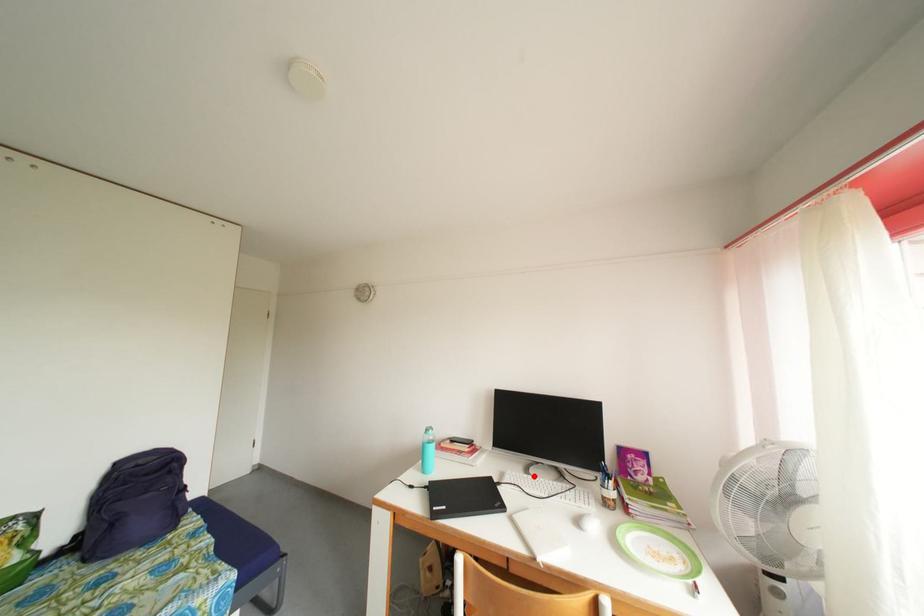
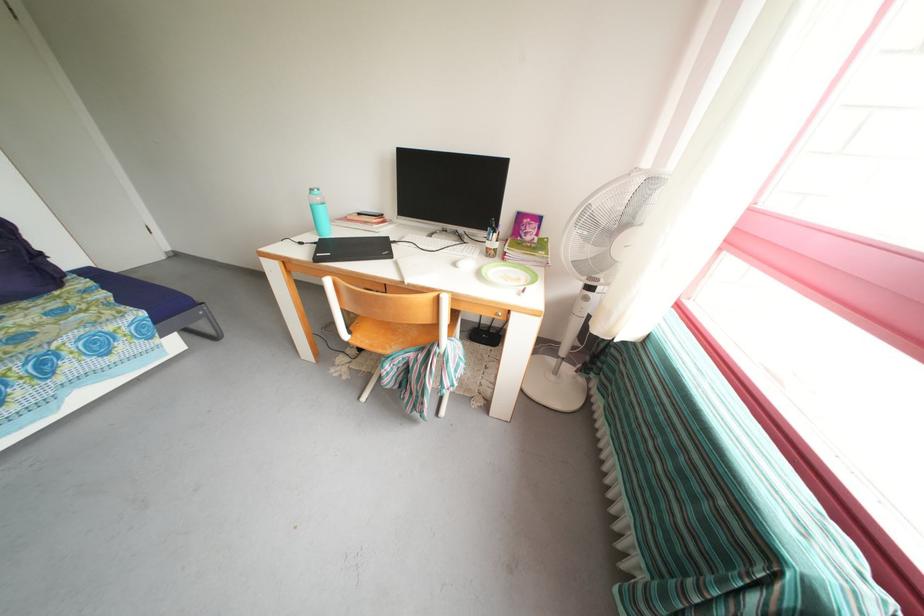
The point at the highlighted location is marked in the first image. Where is the corresponding point in the second image?

(436, 241)